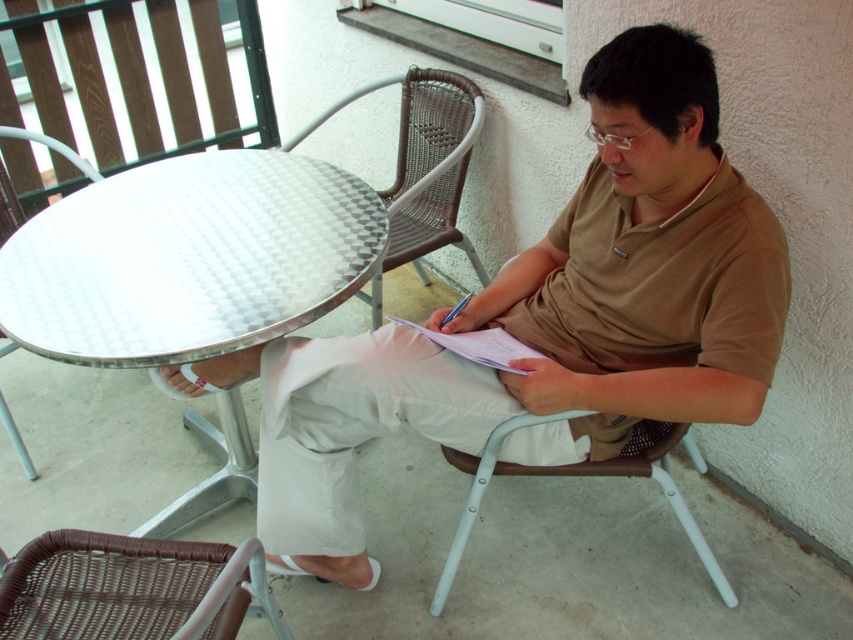
Is point (254, 497) farther from camera compared to point (18, 216)?

That is False.

Is metallic silver table at center positioned at the back of metallic white table at left?

No, it is not.

Is point (78, 268) positioned after point (86, 161)?

That is False.

Locate an element on the screen. Image resolution: width=853 pixels, height=640 pixels. metallic silver table at center is located at coordinates click(x=189, y=259).

Is woven rattan chair at center to the right of metallic white table at left from the viewer's perspective?

Yes, woven rattan chair at center is to the right of metallic white table at left.

Does woven rattan chair at center have a greater width compared to metallic white table at left?

Correct, the width of woven rattan chair at center exceeds that of metallic white table at left.

Is point (460, 188) positioned behind point (94, 177)?

Yes, it is behind point (94, 177).

Locate an element on the screen. This screenshot has width=853, height=640. woven rattan chair at center is located at coordinates (422, 168).

Does woven rattan chair at center appear on the right side of white paper at center?

Incorrect, woven rattan chair at center is not on the right side of white paper at center.

The width and height of the screenshot is (853, 640). Describe the element at coordinates (422, 168) in the screenshot. I see `woven rattan chair at center` at that location.

What are the coordinates of `woven rattan chair at center` in the screenshot? It's located at (422, 168).

You are a GUI agent. You are given a task and a screenshot of the screen. Output one action in this format:
    pyautogui.click(x=<x>, y=<y>)
    Task: Click on the woven rattan chair at center
    
    Given the screenshot: What is the action you would take?
    pyautogui.click(x=422, y=168)